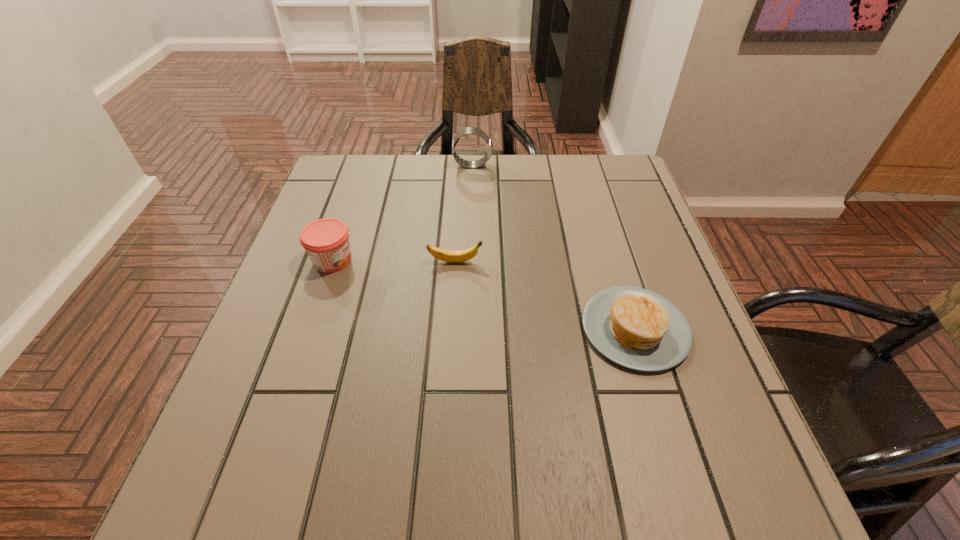
At what (x,y) coordinates should I click in order to perform the action: click on vacant space located on the back of the pancake. Please return your answer as a coordinate pair (x, y). The width and height of the screenshot is (960, 540). Looking at the image, I should click on (608, 240).

This screenshot has height=540, width=960. What are the coordinates of `object present at the far edge` in the screenshot? It's located at (468, 130).

You are a GUI agent. You are given a task and a screenshot of the screen. Output one action in this format:
    pyautogui.click(x=<x>, y=<y>)
    Task: Click on the object that is positioned at the left edge
    This screenshot has height=540, width=960.
    Given the screenshot: What is the action you would take?
    pyautogui.click(x=326, y=241)

Where is `object that is at the right edge`? The image size is (960, 540). object that is at the right edge is located at coordinates (636, 328).

Image resolution: width=960 pixels, height=540 pixels. Identify the location of free region at the far edge of the desktop. (565, 183).

This screenshot has width=960, height=540. Identify the location of free region at the near edge of the desktop. (647, 465).

At what (x,y) coordinates should I click in order to perform the action: click on vacant region at the left edge of the desktop. Please return your answer as a coordinate pair (x, y). Looking at the image, I should click on (338, 288).

In the image, there is a desktop. In order to click on blank space at the right edge in this screenshot , I will do `click(624, 279)`.

In the image, there is a desktop. Where is `vacant space at the far left corner`? The height and width of the screenshot is (540, 960). vacant space at the far left corner is located at coordinates (330, 174).

Find the location of a particular element. The height and width of the screenshot is (540, 960). free region at the near left corner of the desktop is located at coordinates (212, 468).